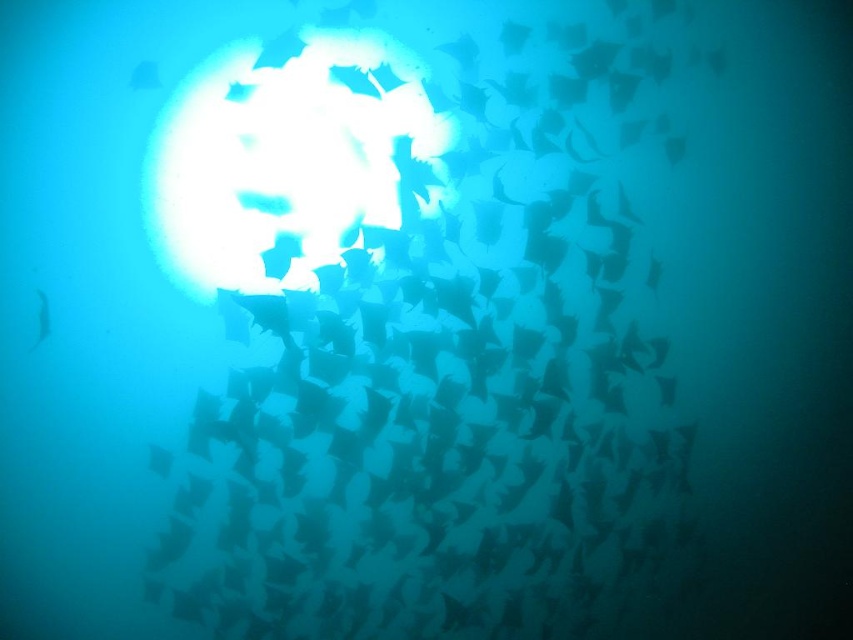
Question: Which point is closer to the camera?

Choices:
 (A) (219, 502)
 (B) (47, 333)

Answer: (B)

Question: Which object is closer to the camera taking this photo?

Choices:
 (A) translucent blue fish at left
 (B) translucent white fish at center

Answer: (B)

Question: Does translucent white fish at center have a greater width compared to translucent blue fish at left?

Choices:
 (A) no
 (B) yes

Answer: (B)

Question: Which of the following is the farthest from the observer?

Choices:
 (A) translucent white fish at center
 (B) translucent blue fish at left

Answer: (B)

Question: Is translucent white fish at center above translucent blue fish at left?

Choices:
 (A) no
 (B) yes

Answer: (A)

Question: Is translucent white fish at center thinner than translucent blue fish at left?

Choices:
 (A) no
 (B) yes

Answer: (A)